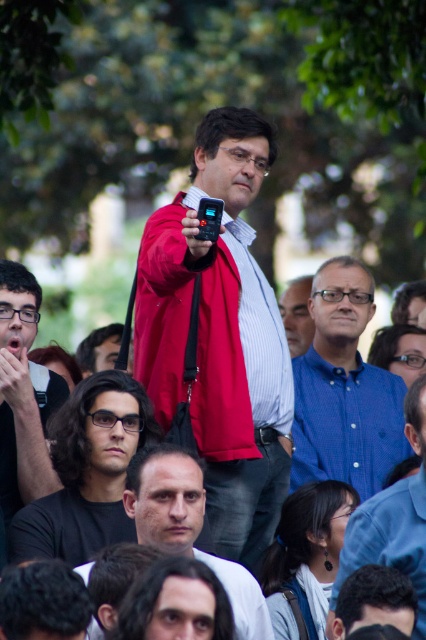
You are a photographer at the event and want to capture a clear shot of the matte black phone at center and the matte black glasses at left. Since the phone is taller than the glasses, which object should you focus on if you want to ensure both are fully in frame without cropping?

The matte black phone at center is taller than the matte black glasses at left, so you should focus on the matte black phone at center to ensure both objects are fully visible without cropping.